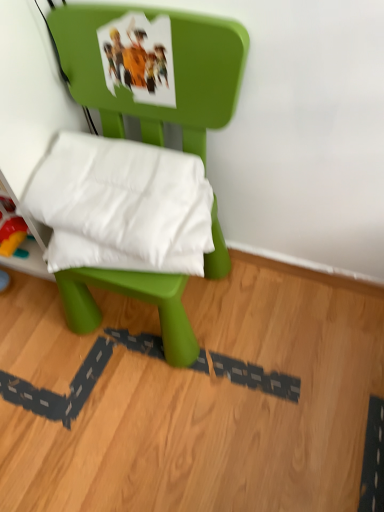
At what (x,y) coordinates should I click in order to perform the action: click on white soft pillow at center. Please return your answer as a coordinate pair (x, y). Image resolution: width=384 pixels, height=512 pixels. Looking at the image, I should click on (122, 206).

What do you see at coordinates (122, 206) in the screenshot? Image resolution: width=384 pixels, height=512 pixels. I see `white soft pillow at center` at bounding box center [122, 206].

Find the location of `green plastic chair at center`. green plastic chair at center is located at coordinates (174, 72).

Measure the distance between point (160, 307) and camera.

They are 34.88 inches apart.

Describe the element at coordinates (174, 72) in the screenshot. The width and height of the screenshot is (384, 512). I see `green plastic chair at center` at that location.

In order to click on white soft pillow at center in this screenshot , I will do `click(122, 206)`.

Does green plastic chair at center appear on the left side of white soft pillow at center?

Incorrect, green plastic chair at center is not on the left side of white soft pillow at center.

Based on the photo, in the image, is green plastic chair at center positioned in front of or behind white soft pillow at center?

green plastic chair at center is in front of white soft pillow at center.

Is point (189, 27) positioned in front of point (182, 218)?

That is True.

From the image's perspective, is green plastic chair at center above or below white soft pillow at center?

Clearly, from the image's perspective, green plastic chair at center is below white soft pillow at center.

From a real-world perspective, is green plastic chair at center physically located above or below white soft pillow at center?

green plastic chair at center is below white soft pillow at center.

Considering the relative sizes of green plastic chair at center and white soft pillow at center in the image provided, is green plastic chair at center thinner than white soft pillow at center?

No.

Which of these two, green plastic chair at center or white soft pillow at center, stands taller?

Standing taller between the two is green plastic chair at center.

Looking at this image, looking at the image, does green plastic chair at center seem bigger or smaller compared to white soft pillow at center?

Considering their sizes, green plastic chair at center takes up more space than white soft pillow at center.

Is white soft pillow at center a part of green plastic chair at center?

Indeed, white soft pillow at center is located within green plastic chair at center.

Is green plastic chair at center far away from white soft pillow at center?

green plastic chair at center is actually quite close to white soft pillow at center.

Is green plastic chair at center aimed at white soft pillow at center?

Yes, green plastic chair at center is turned towards white soft pillow at center.

Can you tell me how much green plastic chair at center and white soft pillow at center differ in facing direction?

They differ by 10.5 degrees in their facing directions.

Image resolution: width=384 pixels, height=512 pixels. Find the location of `furniture lying on the right of white soft pillow at center`. furniture lying on the right of white soft pillow at center is located at coordinates (174, 72).

Would you say white soft pillow at center is to the left or to the right of green plastic chair at center in the picture?

white soft pillow at center is positioned on green plastic chair at center's left side.

Which object is further away from the camera taking this photo, white soft pillow at center or green plastic chair at center?

white soft pillow at center.

Does point (143, 158) come farther from viewer compared to point (151, 124)?

No, it is not.

From the image's perspective, is white soft pillow at center located beneath green plastic chair at center?

No.

From the picture: From a real-world perspective, who is located lower, white soft pillow at center or green plastic chair at center?

green plastic chair at center is physically lower.

Can you confirm if white soft pillow at center is thinner than green plastic chair at center?

Indeed, white soft pillow at center has a lesser width compared to green plastic chair at center.

Who is shorter, white soft pillow at center or green plastic chair at center?

white soft pillow at center is shorter.

Does white soft pillow at center have a smaller size compared to green plastic chair at center?

Yes, white soft pillow at center is smaller than green plastic chair at center.

Is white soft pillow at center positioned beyond the bounds of green plastic chair at center?

No, most part of white soft pillow at center lies within green plastic chair at center.

Would you consider white soft pillow at center to be distant from green plastic chair at center?

No, white soft pillow at center is in close proximity to green plastic chair at center.

Is white soft pillow at center aimed at green plastic chair at center?

Yes, white soft pillow at center faces towards green plastic chair at center.

Measure the distance from white soft pillow at center to green plastic chair at center.

white soft pillow at center is 7.05 inches away from green plastic chair at center.

The image size is (384, 512). Identify the location of pillow behind the green plastic chair at center. (122, 206).

Find the location of a particular element. The width and height of the screenshot is (384, 512). furniture on the right of white soft pillow at center is located at coordinates (174, 72).

Where is `furniture below the white soft pillow at center (from the image's perspective)`? The height and width of the screenshot is (512, 384). furniture below the white soft pillow at center (from the image's perspective) is located at coordinates (174, 72).